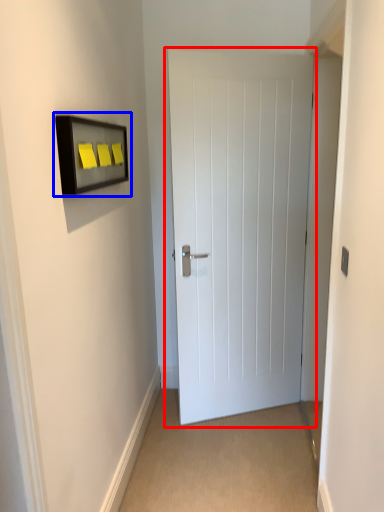
Question: Which object is closer to the camera taking this photo, door (highlighted by a red box) or medicine cabinet (highlighted by a blue box)?

Choices:
 (A) door
 (B) medicine cabinet

Answer: (B)